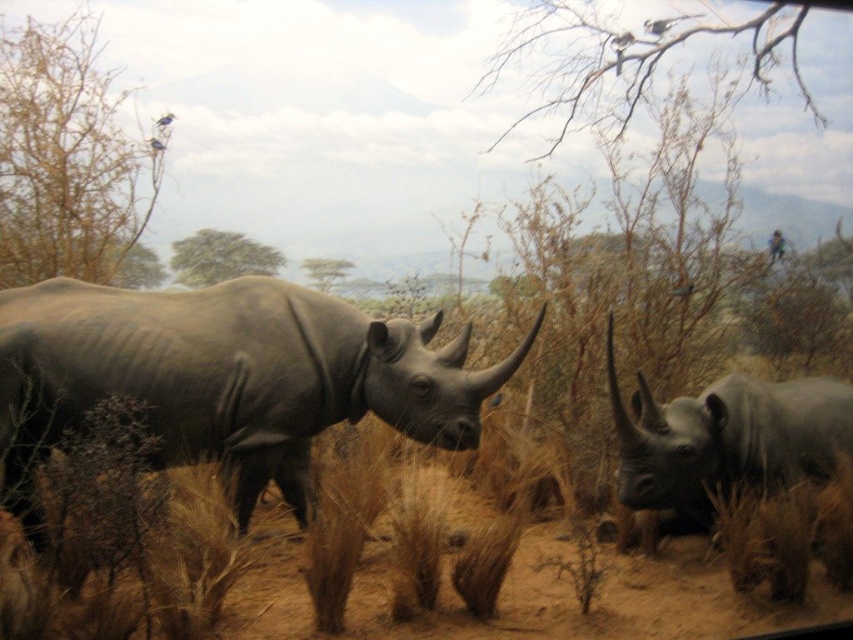
Question: Among these objects, which one is farthest from the camera?

Choices:
 (A) matte gray rhinoceros at center
 (B) matte gray rhinoceros at right

Answer: (B)

Question: Among these objects, which one is nearest to the camera?

Choices:
 (A) matte gray rhinoceros at center
 (B) matte gray rhinoceros at right

Answer: (A)

Question: Does matte gray rhinoceros at center lie behind matte gray rhinoceros at right?

Choices:
 (A) yes
 (B) no

Answer: (B)

Question: Considering the relative positions of matte gray rhinoceros at center and matte gray rhinoceros at right in the image provided, where is matte gray rhinoceros at center located with respect to matte gray rhinoceros at right?

Choices:
 (A) below
 (B) above

Answer: (B)

Question: Where is matte gray rhinoceros at center located in relation to matte gray rhinoceros at right in the image?

Choices:
 (A) left
 (B) right

Answer: (A)